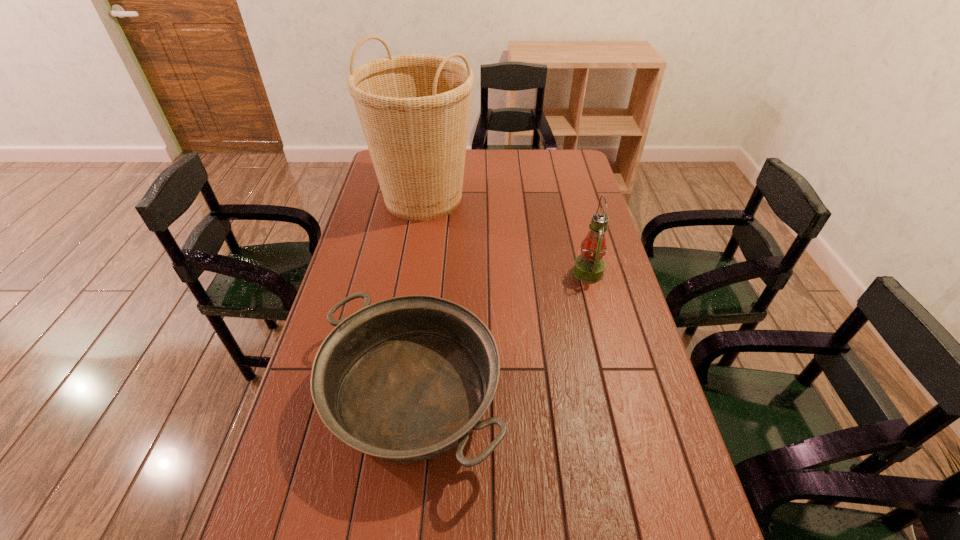
Identify the location of basket at the left edge. Image resolution: width=960 pixels, height=540 pixels. (414, 109).

This screenshot has height=540, width=960. Find the location of `pan that is at the left edge`. pan that is at the left edge is located at coordinates (406, 379).

You are a GUI agent. You are given a task and a screenshot of the screen. Output one action in this format:
    pyautogui.click(x=<x>, y=<y>)
    Task: Click on the object that is at the right edge
    The width and height of the screenshot is (960, 540).
    Given the screenshot: What is the action you would take?
    pyautogui.click(x=589, y=267)

This screenshot has width=960, height=540. I want to click on object that is at the far left corner, so click(x=414, y=109).

The width and height of the screenshot is (960, 540). In the image, there is a desktop. Identify the location of vacant space at the far edge. (496, 161).

The width and height of the screenshot is (960, 540). Find the location of `vacant space at the left edge`. vacant space at the left edge is located at coordinates (312, 470).

In the image, there is a desktop. Identify the location of free region at the right edge. The image size is (960, 540). (661, 529).

Identify the location of vacant space that's between the shortest object and the second shortest object. (500, 334).

Find the location of a particular element. The width and height of the screenshot is (960, 540). unoccupied area between the nearest object and the rightmost object is located at coordinates (500, 334).

Find the location of a particular element. Image resolution: width=960 pixels, height=540 pixels. unoccupied position between the rightmost object and the tallest object is located at coordinates (506, 235).